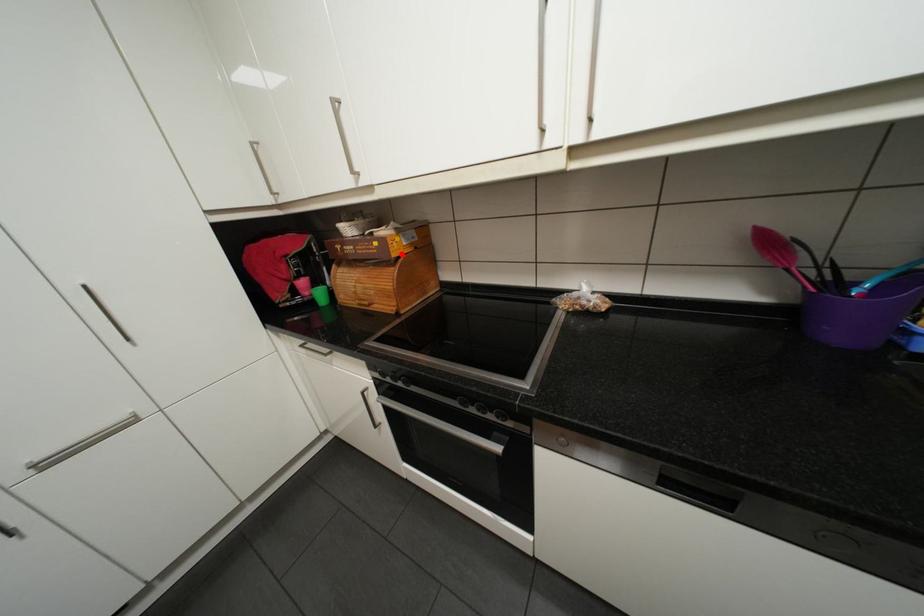
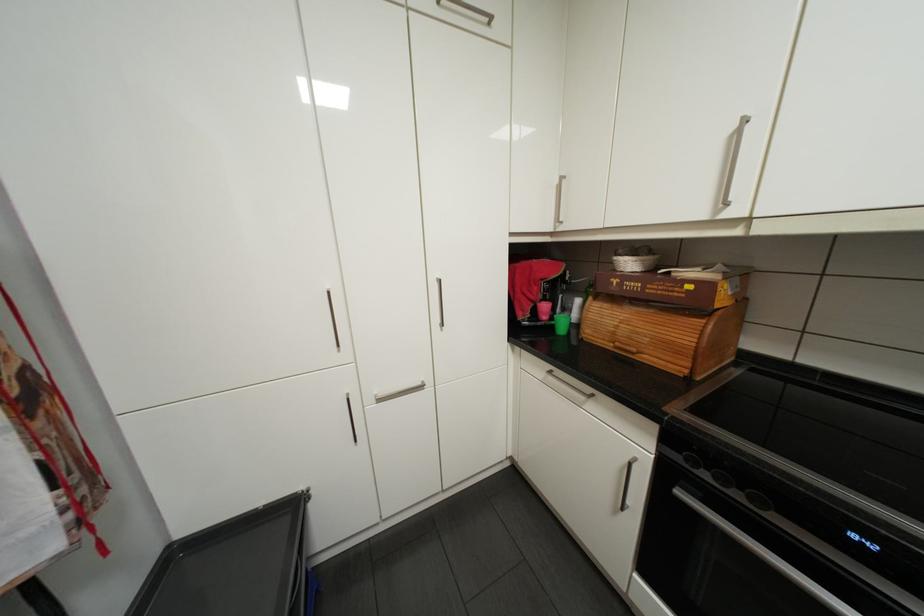
Question: I am providing you with two images of the same scene from different viewpoints. A red point is marked on the first image. At the location where the point appears in image 1, is it still visible in image 2?

Choices:
 (A) Yes
 (B) No

Answer: (A)